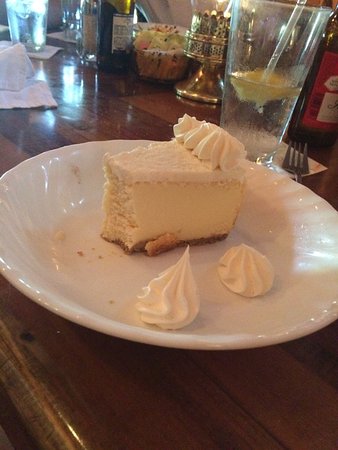
Locate an element on the screen. Image resolution: width=338 pixels, height=450 pixels. fork is located at coordinates (292, 166).